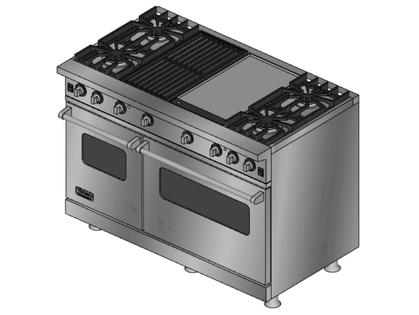
The image size is (419, 315). Find the location of `right back hob plate`. right back hob plate is located at coordinates (304, 92).